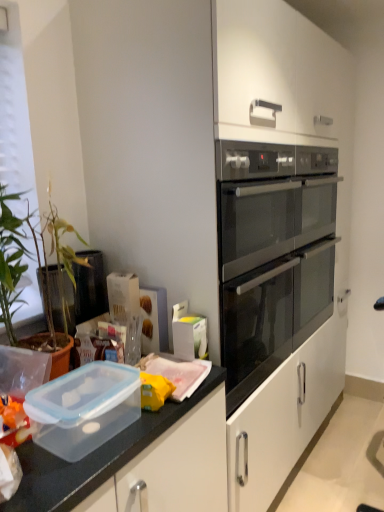
Question: From a real-world perspective, is transparent plastic container at lower left located higher than satin black oven at center right?

Choices:
 (A) no
 (B) yes

Answer: (A)

Question: From the image's perspective, is transparent plastic container at lower left over satin black oven at center right?

Choices:
 (A) yes
 (B) no

Answer: (B)

Question: Considering the relative positions of transparent plastic container at lower left and satin black oven at center right in the image provided, is transparent plastic container at lower left to the right of satin black oven at center right from the viewer's perspective?

Choices:
 (A) no
 (B) yes

Answer: (A)

Question: Is transparent plastic container at lower left smaller than satin black oven at center right?

Choices:
 (A) no
 (B) yes

Answer: (B)

Question: Can you confirm if transparent plastic container at lower left is thinner than satin black oven at center right?

Choices:
 (A) yes
 (B) no

Answer: (A)

Question: From the image's perspective, is transparent plastic container at lower left beneath satin black oven at center right?

Choices:
 (A) yes
 (B) no

Answer: (A)

Question: Does satin black oven at center right come behind transparent plastic container at lower left?

Choices:
 (A) no
 (B) yes

Answer: (B)

Question: From the image's perspective, would you say satin black oven at center right is shown under transparent plastic container at lower left?

Choices:
 (A) yes
 (B) no

Answer: (B)

Question: Does satin black oven at center right appear on the right side of transparent plastic container at lower left?

Choices:
 (A) no
 (B) yes

Answer: (B)

Question: Considering the relative sizes of satin black oven at center right and transparent plastic container at lower left in the image provided, is satin black oven at center right wider than transparent plastic container at lower left?

Choices:
 (A) yes
 (B) no

Answer: (A)

Question: Is satin black oven at center right shorter than transparent plastic container at lower left?

Choices:
 (A) yes
 (B) no

Answer: (B)

Question: From a real-world perspective, is satin black oven at center right physically below transparent plastic container at lower left?

Choices:
 (A) yes
 (B) no

Answer: (B)

Question: From a real-world perspective, is transparent plastic container at lower left above or below satin black oven at center right?

Choices:
 (A) above
 (B) below

Answer: (B)